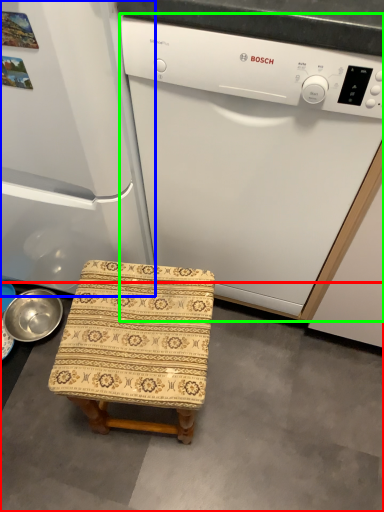
Question: Which is farther away from concrete (highlighted by a red box)? refrigerator (highlighted by a blue box) or home appliance (highlighted by a green box)?

Choices:
 (A) refrigerator
 (B) home appliance

Answer: (A)